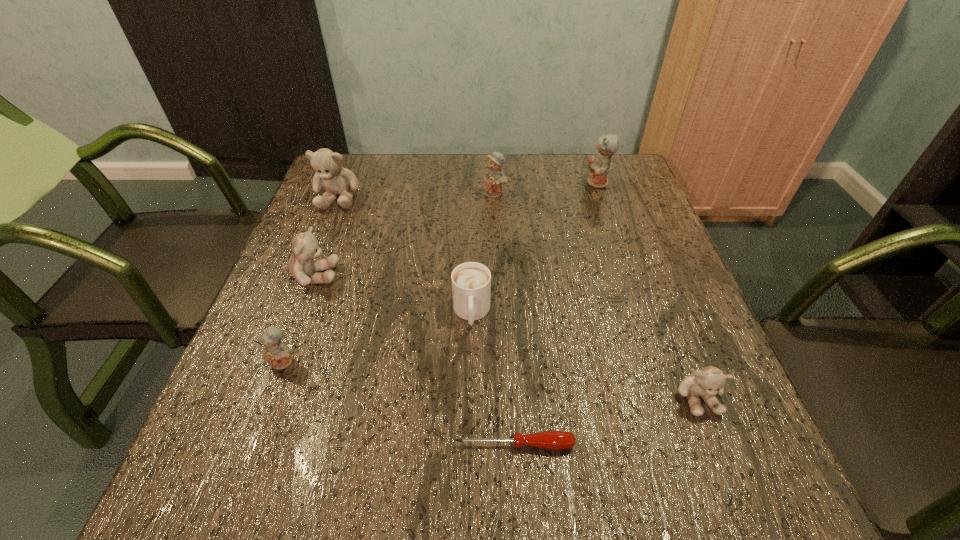
Where is `the biggest blue teddy bear`? the biggest blue teddy bear is located at coordinates (599, 165).

You are a GUI agent. You are given a task and a screenshot of the screen. Output one action in this format:
    pyautogui.click(x=<x>, y=<y>)
    Task: Click on the farthest gray teddy bear
    The height and width of the screenshot is (540, 960).
    Given the screenshot: What is the action you would take?
    pyautogui.click(x=336, y=180)

Where is `the fourth teddy bear from left to right`? This screenshot has height=540, width=960. the fourth teddy bear from left to right is located at coordinates (494, 177).

In order to click on the second smallest blue teddy bear in this screenshot , I will do `click(494, 177)`.

Identify the location of the fourth farthest object. The height and width of the screenshot is (540, 960). (305, 247).

This screenshot has width=960, height=540. I want to click on the fourth farthest teddy bear, so click(x=305, y=247).

Where is `white cappuccino`? This screenshot has width=960, height=540. white cappuccino is located at coordinates (471, 282).

You are a GUI agent. You are given a task and a screenshot of the screen. Output one action in this format:
    pyautogui.click(x=<x>, y=<y>)
    Task: Click on the cappuccino
    The image size is (960, 540).
    Given the screenshot: What is the action you would take?
    pyautogui.click(x=471, y=282)

Identify the location of the nearest blue teddy bear. (279, 356).

At what (x,y) coordinates should I click in order to perform the action: click on the second nearest teddy bear. Please return your answer as a coordinate pair (x, y). Looking at the image, I should click on (279, 356).